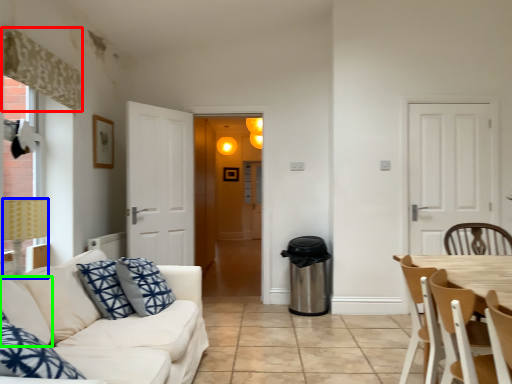
Question: Based on their relative distances, which object is farther from curtain (highlighted by a red box)? Choose from lamp (highlighted by a blue box) and pillow (highlighted by a green box).

Choices:
 (A) lamp
 (B) pillow

Answer: (B)